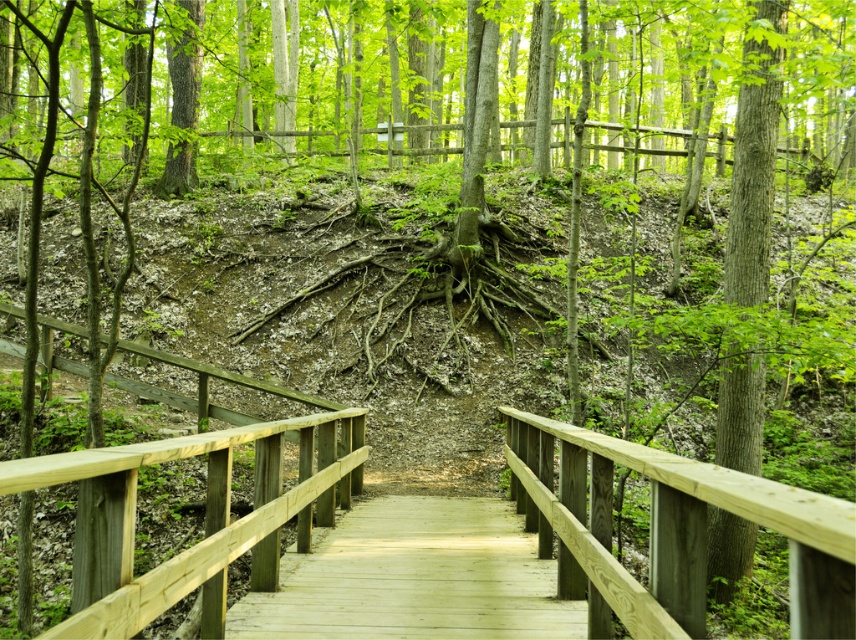
Question: Is light brown wooden path at center below smooth brown tree trunk at center-right?

Choices:
 (A) yes
 (B) no

Answer: (A)

Question: Which point appears farthest from the camera in this image?

Choices:
 (A) (296, 589)
 (B) (747, 289)

Answer: (B)

Question: Among these points, which one is nearest to the camera?

Choices:
 (A) (321, 605)
 (B) (746, 150)

Answer: (A)

Question: Is light brown wooden path at center bigger than smooth brown tree trunk at center-right?

Choices:
 (A) yes
 (B) no

Answer: (B)

Question: Is light brown wooden path at center further to camera compared to smooth brown tree trunk at center-right?

Choices:
 (A) no
 (B) yes

Answer: (A)